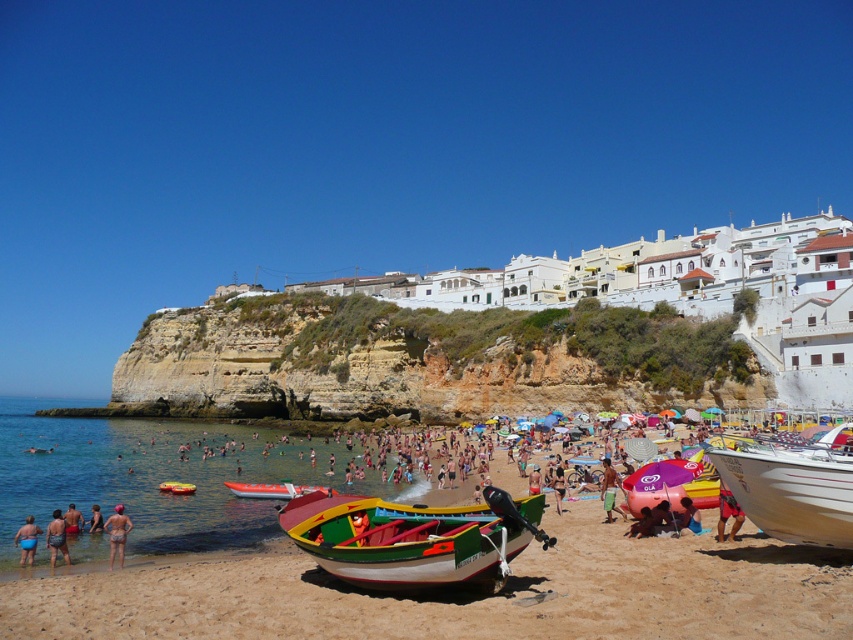
Can you confirm if purple glossy inflatable at center is positioned to the right of green fabric bucket at center?

Correct, you'll find purple glossy inflatable at center to the right of green fabric bucket at center.

Where is `purple glossy inflatable at center`? Image resolution: width=853 pixels, height=640 pixels. purple glossy inflatable at center is located at coordinates (668, 484).

Is point (659, 496) farther from camera compared to point (611, 499)?

No.

At what (x,y) coordinates should I click in order to perform the action: click on purple glossy inflatable at center. Please return your answer as a coordinate pair (x, y). Looking at the image, I should click on (668, 484).

Does green painted wood boat at center have a lesser height compared to blue matte swimsuit at lower left?

Incorrect, green painted wood boat at center's height does not fall short of blue matte swimsuit at lower left's.

The image size is (853, 640). I want to click on green painted wood boat at center, so click(415, 538).

Identify the location of green painted wood boat at center. This screenshot has height=640, width=853. (415, 538).

Which of these two, orange fiberglass boat at center or tan skin person at lower left, stands taller?

tan skin person at lower left

Is point (244, 483) positioned after point (64, 522)?

Yes, point (244, 483) is behind point (64, 522).

Locate an element on the screen. orange fiberglass boat at center is located at coordinates (270, 490).